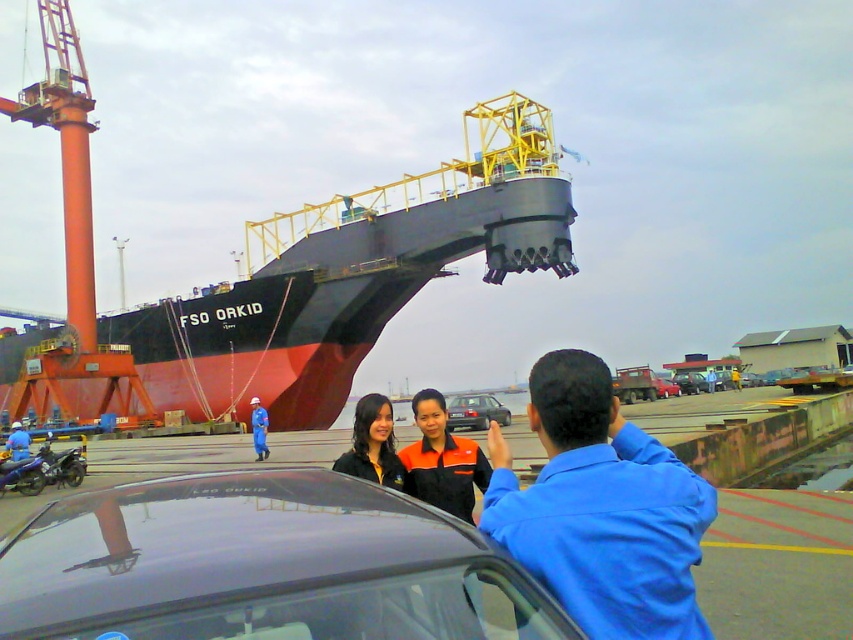
Question: Is matte black jacket at center smaller than blue fabric uniform at center?

Choices:
 (A) no
 (B) yes

Answer: (A)

Question: Which of the following is the closest to the observer?

Choices:
 (A) blue shirt at center
 (B) glossy black car at center
 (C) matte black jacket at center

Answer: (B)

Question: Is glossy black car at center positioned behind blue shirt at center?

Choices:
 (A) yes
 (B) no

Answer: (B)

Question: Can you confirm if matte black jacket at center is positioned below metallic red truck at center?

Choices:
 (A) yes
 (B) no

Answer: (B)

Question: Which of the following is the closest to the observer?

Choices:
 (A) black matte ship at center
 (B) satin silver sedan at center
 (C) blue fabric uniform at center

Answer: (B)

Question: Which point is closer to the camera taking this photo?

Choices:
 (A) (257, 412)
 (B) (280, 324)

Answer: (A)